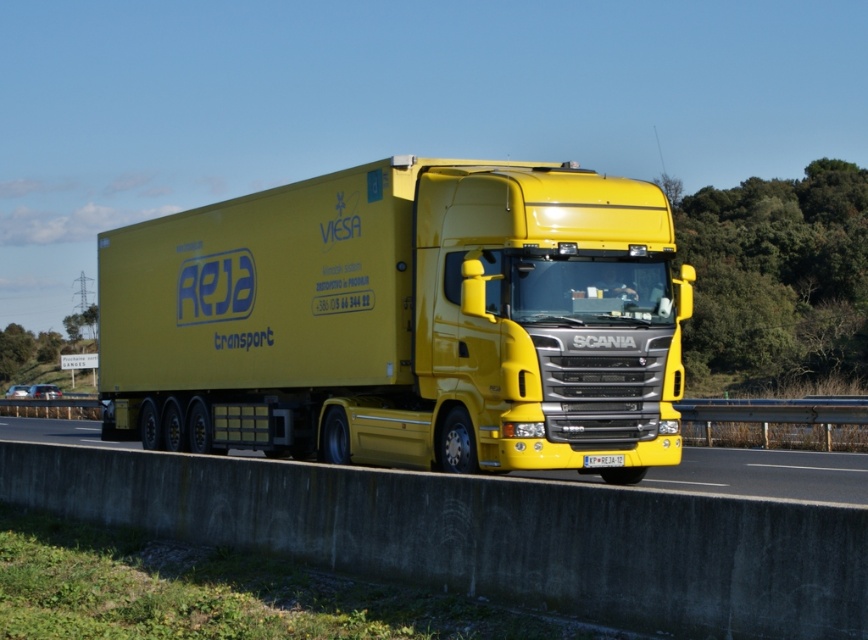
You are a traffic analyst studying the positioning of vehicles on a highway. Given the coordinates provided, where exactly is the yellow matte truck at center positioned on the image?

The yellow matte truck at center is located at point (404, 321).

You are a delivery driver approaching a highway with a yellow matte truck at center and a yellow glossy concrete barrier at lower center. Which object is taller?

The yellow matte truck at center is much taller than the yellow glossy concrete barrier at lower center.